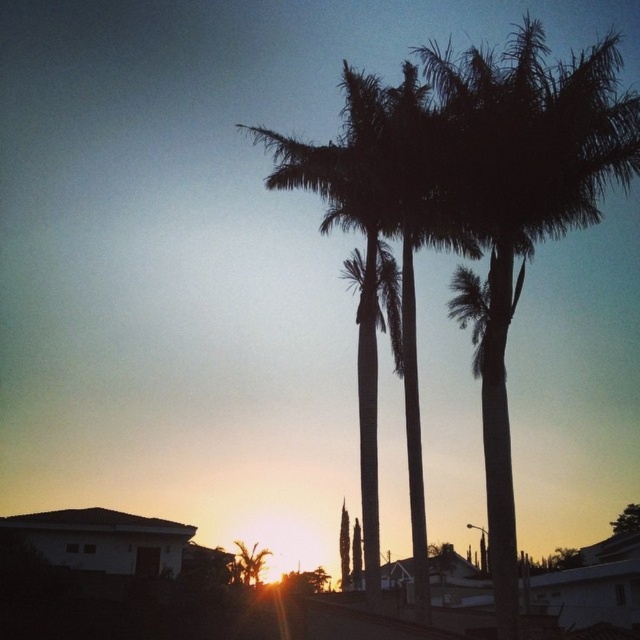
You are an astronomer analyzing the sunset scene. You need to determine the position of the silhouette leafy palm at upper center in the image. What are its coordinates?

The silhouette leafy palm at upper center is located at coordinates (525,204).

You are standing in the residential area and looking at the sunset. You see the silhouette leafy palm at upper center and the green leafy tree at upper center. Which tree is closer to you?

The silhouette leafy palm at upper center is closer to the viewer than the green leafy tree at upper center.

You are an architect designing a new park and want to place both the silhouette leafy palm at upper center and the green leafy tree at upper center in the park layout. Based on their widths, which one should you place closer to the park entrance to ensure visitors notice it first?

The silhouette leafy palm at upper center should be placed closer to the park entrance because its width surpasses the green leafy tree at upper center, making it more noticeable.